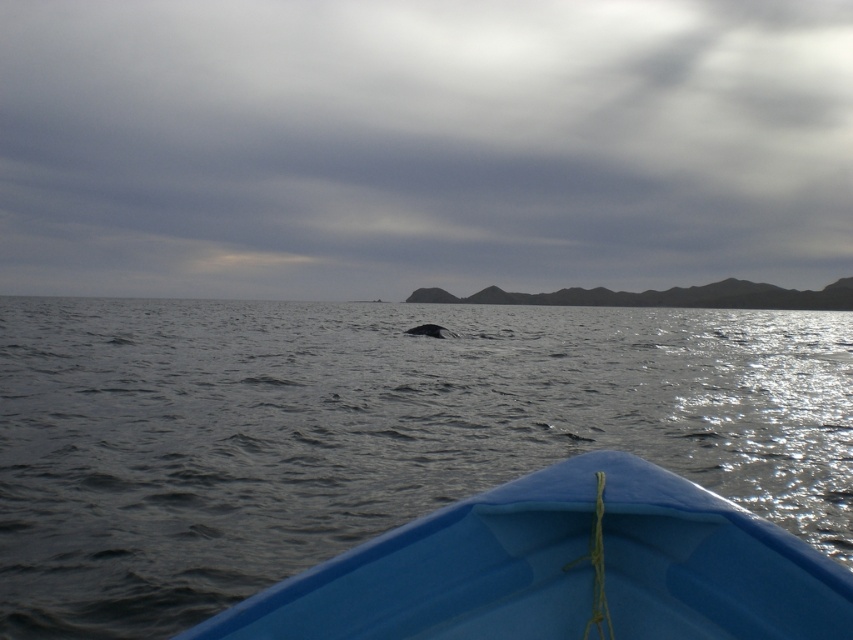
Question: Which object is closer to the camera taking this photo?

Choices:
 (A) gray matte water at center
 (B) gray matte whale at center
 (C) gray cloudy sky at upper center

Answer: (A)

Question: Can you confirm if gray matte water at center is positioned above blue plastic boat at lower center?

Choices:
 (A) no
 (B) yes

Answer: (B)

Question: Does gray matte water at center have a lesser width compared to blue plastic boat at lower center?

Choices:
 (A) no
 (B) yes

Answer: (A)

Question: Which point is closer to the camera?

Choices:
 (A) (410, 328)
 (B) (498, 115)
 (C) (506, 586)

Answer: (C)

Question: Observing the image, what is the correct spatial positioning of gray cloudy sky at upper center in reference to gray matte whale at center?

Choices:
 (A) above
 (B) below

Answer: (A)

Question: Among these objects, which one is farthest from the camera?

Choices:
 (A) gray matte water at center
 (B) gray matte whale at center

Answer: (B)